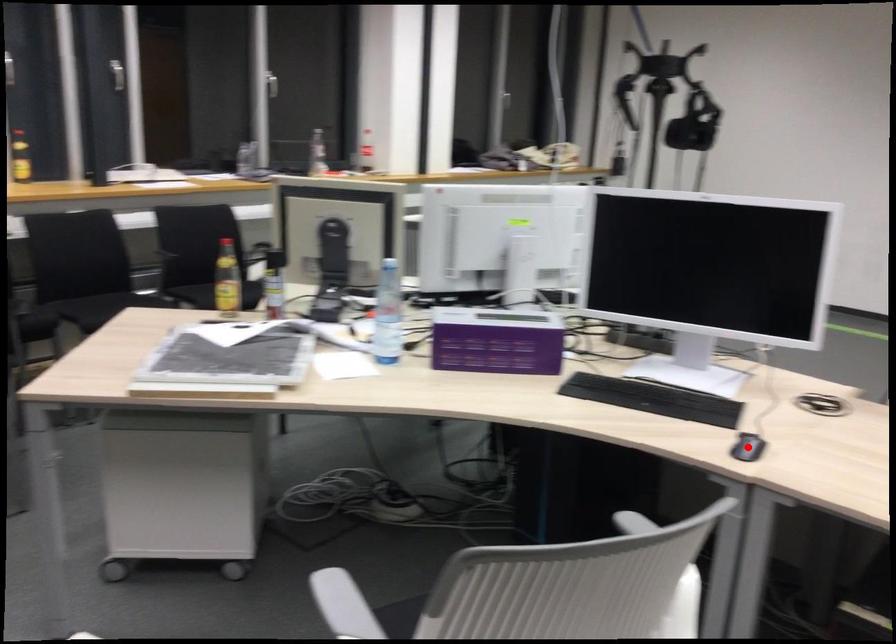
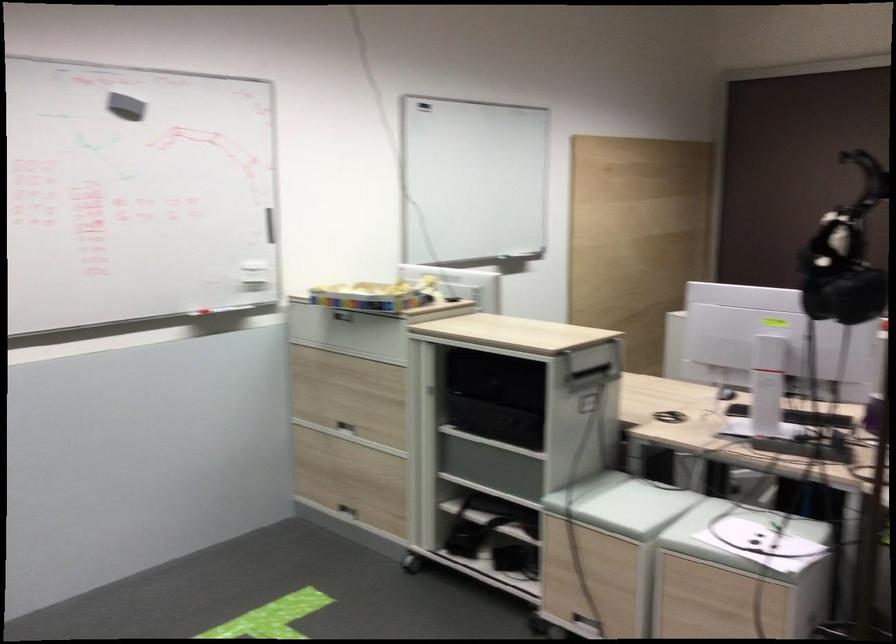
Question: I am providing you with two images of the same scene from different viewpoints. A red point is marked on the first image. Can you still see the location of the red point in image 2?

Choices:
 (A) Yes
 (B) No

Answer: (B)